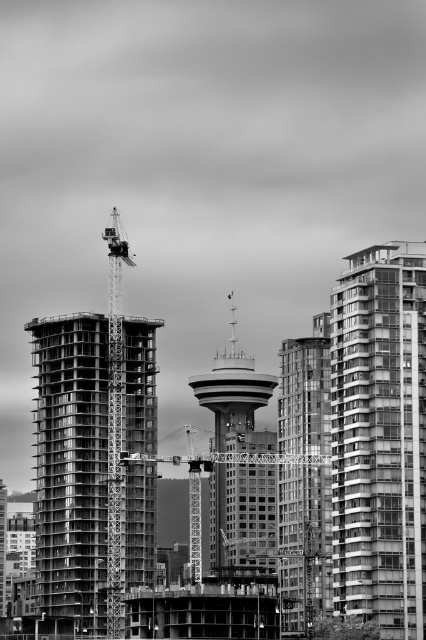
You are a construction worker standing at the edge of the construction site. You need to move a heavy beam from the concrete construction at center to the smooth concrete tower at center. Which structure should you start working on first, the one closer or farther away?

You should start working on the concrete construction at center first since it is closer to you than the smooth concrete tower at center, allowing easier access.

You are an architect evaluating the construction site. You notice the smooth glass building at center and the metallic construction crane at center. Which of these two occupies a smaller area in the image?

The smooth glass building at center occupies less space than the metallic construction crane at center, so the smooth glass building at center is the one that occupies a smaller area.